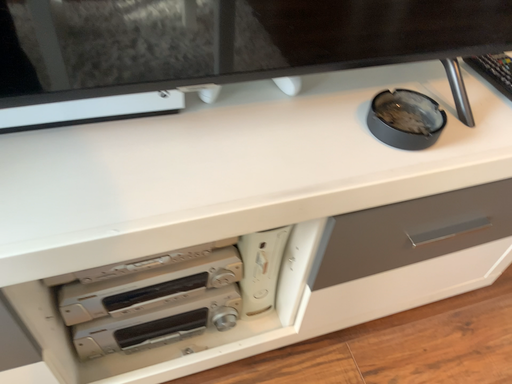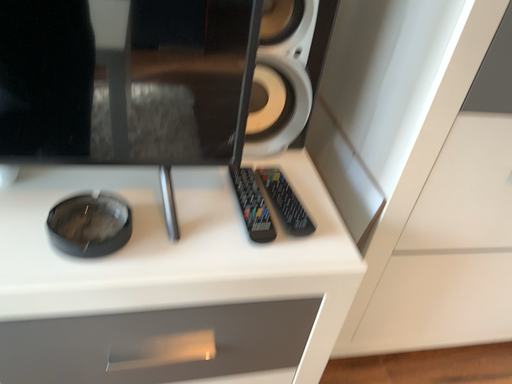
Question: How did the camera likely rotate when shooting the video?

Choices:
 (A) rotated downward
 (B) rotated upward

Answer: (B)